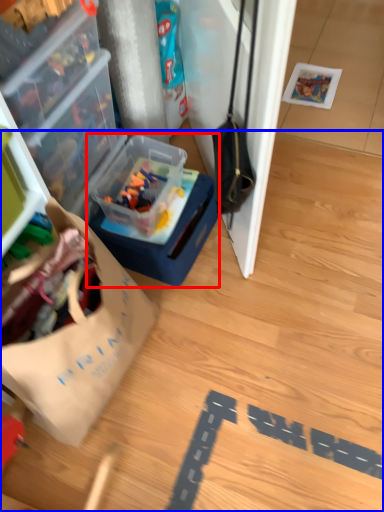
Question: Among these objects, which one is nearest to the camera, box (highlighted by a red box) or wood (highlighted by a blue box)?

Choices:
 (A) box
 (B) wood

Answer: (B)